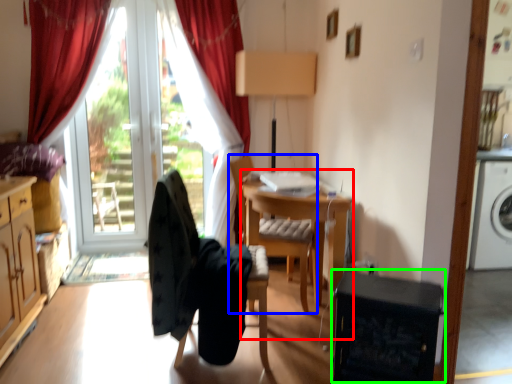
Question: Estimate the real-world distances between objects in this image. Which object is closer to computer desk (highlighted by a red box), chair (highlighted by a blue box) or dish washer (highlighted by a green box)?

Choices:
 (A) chair
 (B) dish washer

Answer: (A)